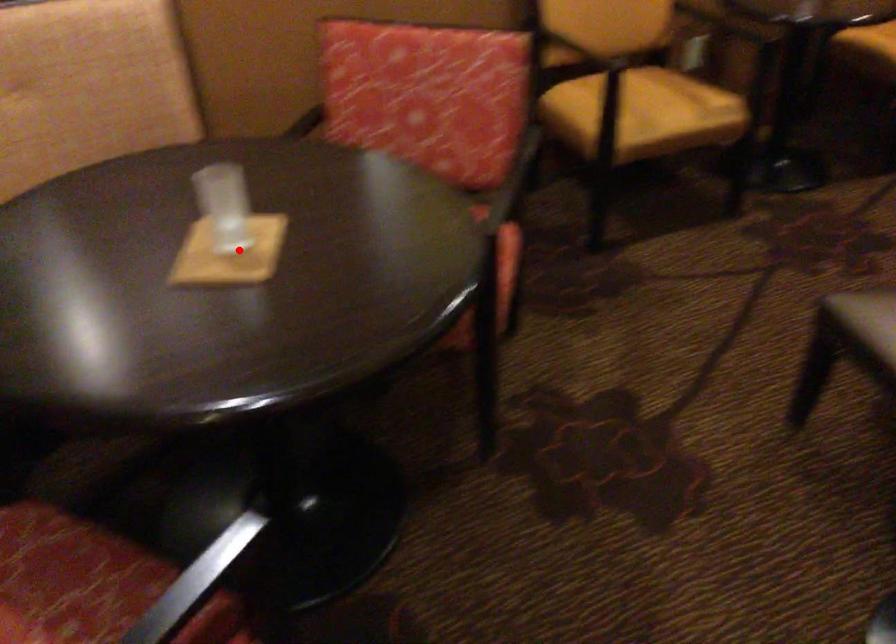
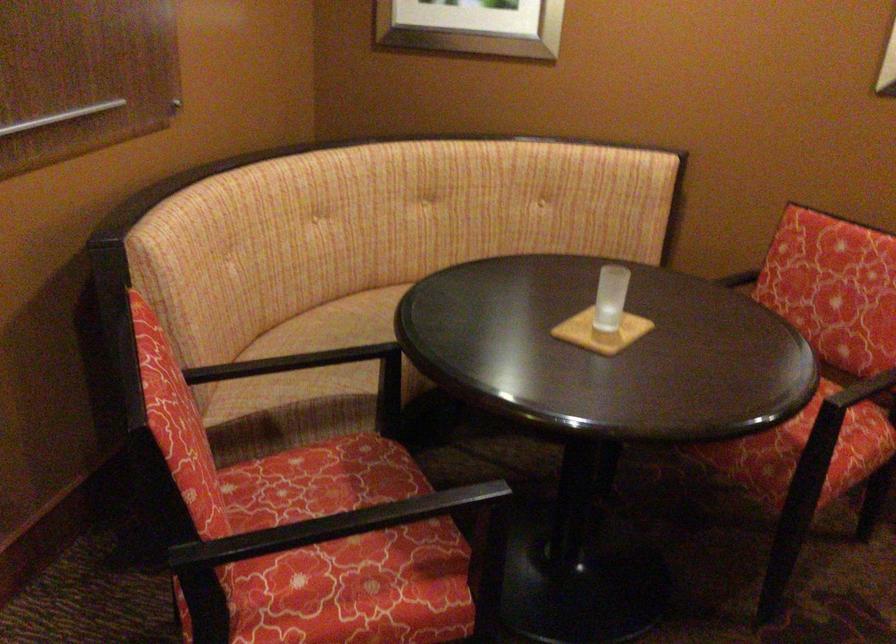
Question: I am providing you with two images of the same scene from different viewpoints. A red point is shown in image1. For the corresponding object point in image2, is it positioned nearer or farther from the camera?

Choices:
 (A) Nearer
 (B) Farther

Answer: (B)